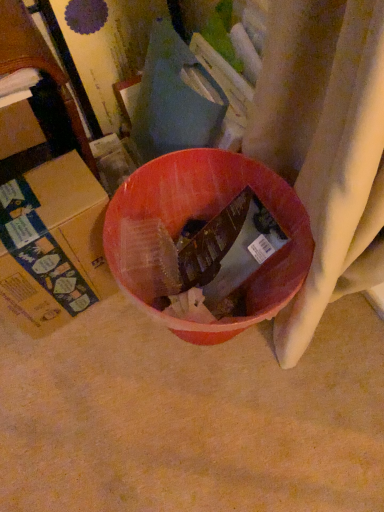
Measure the distance between cardboard box at left, which is counted as the second cardboard box, starting from the bottom, and camera.

26.34 inches.

What do you see at coordinates (19, 129) in the screenshot? This screenshot has width=384, height=512. I see `cardboard box at left, which is counted as the second cardboard box, starting from the bottom` at bounding box center [19, 129].

I want to click on cardboard box at left, marked as the 1th cardboard box in a top-to-bottom arrangement, so click(x=19, y=129).

Image resolution: width=384 pixels, height=512 pixels. What are the coordinates of `cardboard box at left, positioned as the second cardboard box in top-to-bottom order` in the screenshot? It's located at (52, 245).

What do you see at coordinates (52, 245) in the screenshot? I see `cardboard box at left, the 1th cardboard box from the bottom` at bounding box center [52, 245].

Where is `cardboard box at left, which is counted as the second cardboard box, starting from the bottom`? cardboard box at left, which is counted as the second cardboard box, starting from the bottom is located at coordinates (19, 129).

Between cardboard box at left, the 1th cardboard box from the bottom, and cardboard box at left, which is counted as the second cardboard box, starting from the bottom, which one appears on the left side from the viewer's perspective?

From the viewer's perspective, cardboard box at left, which is counted as the second cardboard box, starting from the bottom, appears more on the left side.

In the scene shown: Which is in front, cardboard box at left, positioned as the second cardboard box in top-to-bottom order, or cardboard box at left, which is counted as the second cardboard box, starting from the bottom?

cardboard box at left, positioned as the second cardboard box in top-to-bottom order.

Considering the points (94, 231) and (10, 105), which point is in front, point (94, 231) or point (10, 105)?

The point (10, 105) is closer to the camera.

From the image's perspective, is cardboard box at left, positioned as the second cardboard box in top-to-bottom order, positioned above or below cardboard box at left, marked as the 1th cardboard box in a top-to-bottom arrangement?

From the image's perspective, cardboard box at left, positioned as the second cardboard box in top-to-bottom order, appears below cardboard box at left, marked as the 1th cardboard box in a top-to-bottom arrangement.

From a real-world perspective, is cardboard box at left, the 1th cardboard box from the bottom, physically located above or below cardboard box at left, marked as the 1th cardboard box in a top-to-bottom arrangement?

cardboard box at left, the 1th cardboard box from the bottom, is situated lower than cardboard box at left, marked as the 1th cardboard box in a top-to-bottom arrangement, in the real world.

Between cardboard box at left, positioned as the second cardboard box in top-to-bottom order, and cardboard box at left, which is counted as the second cardboard box, starting from the bottom, which one has larger width?

cardboard box at left, positioned as the second cardboard box in top-to-bottom order.

In terms of height, does cardboard box at left, positioned as the second cardboard box in top-to-bottom order, look taller or shorter compared to cardboard box at left, which is counted as the second cardboard box, starting from the bottom?

Considering their sizes, cardboard box at left, positioned as the second cardboard box in top-to-bottom order, has more height than cardboard box at left, which is counted as the second cardboard box, starting from the bottom.

Which of these two, cardboard box at left, the 1th cardboard box from the bottom, or cardboard box at left, marked as the 1th cardboard box in a top-to-bottom arrangement, is bigger?

With larger size is cardboard box at left, the 1th cardboard box from the bottom.

Would you say cardboard box at left, which is counted as the second cardboard box, starting from the bottom, is part of cardboard box at left, positioned as the second cardboard box in top-to-bottom order,'s contents?

No.

Is cardboard box at left, the 1th cardboard box from the bottom, positioned far away from cardboard box at left, which is counted as the second cardboard box, starting from the bottom?

cardboard box at left, the 1th cardboard box from the bottom, is actually quite close to cardboard box at left, which is counted as the second cardboard box, starting from the bottom.

Is cardboard box at left, which is counted as the second cardboard box, starting from the bottom, at the back of cardboard box at left, the 1th cardboard box from the bottom?

Yes, cardboard box at left, the 1th cardboard box from the bottom,'s orientation is away from cardboard box at left, which is counted as the second cardboard box, starting from the bottom.

Where is `cardboard box that is behind the cardboard box at left, the 1th cardboard box from the bottom`? This screenshot has height=512, width=384. cardboard box that is behind the cardboard box at left, the 1th cardboard box from the bottom is located at coordinates (19, 129).

Can you confirm if cardboard box at left, marked as the 1th cardboard box in a top-to-bottom arrangement, is positioned to the left of cardboard box at left, positioned as the second cardboard box in top-to-bottom order?

Indeed, cardboard box at left, marked as the 1th cardboard box in a top-to-bottom arrangement, is positioned on the left side of cardboard box at left, positioned as the second cardboard box in top-to-bottom order.

Considering their positions, is cardboard box at left, marked as the 1th cardboard box in a top-to-bottom arrangement, located in front of or behind cardboard box at left, positioned as the second cardboard box in top-to-bottom order?

In the image, cardboard box at left, marked as the 1th cardboard box in a top-to-bottom arrangement, appears behind cardboard box at left, positioned as the second cardboard box in top-to-bottom order.

Is point (38, 137) closer to viewer compared to point (50, 173)?

No, (38, 137) is further to viewer.

From the image's perspective, is cardboard box at left, marked as the 1th cardboard box in a top-to-bottom arrangement, above cardboard box at left, the 1th cardboard box from the bottom?

Yes, from the image's perspective, cardboard box at left, marked as the 1th cardboard box in a top-to-bottom arrangement, is on top of cardboard box at left, the 1th cardboard box from the bottom.

From a real-world perspective, which object stands above the other?

cardboard box at left, which is counted as the second cardboard box, starting from the bottom.

Between cardboard box at left, marked as the 1th cardboard box in a top-to-bottom arrangement, and cardboard box at left, the 1th cardboard box from the bottom, which one has smaller width?

With smaller width is cardboard box at left, marked as the 1th cardboard box in a top-to-bottom arrangement.

Is cardboard box at left, which is counted as the second cardboard box, starting from the bottom, shorter than cardboard box at left, positioned as the second cardboard box in top-to-bottom order?

Yes, cardboard box at left, which is counted as the second cardboard box, starting from the bottom, is shorter than cardboard box at left, positioned as the second cardboard box in top-to-bottom order.

Can you confirm if cardboard box at left, marked as the 1th cardboard box in a top-to-bottom arrangement, is bigger than cardboard box at left, positioned as the second cardboard box in top-to-bottom order?

No.

Is cardboard box at left, marked as the 1th cardboard box in a top-to-bottom arrangement, not inside cardboard box at left, the 1th cardboard box from the bottom?

cardboard box at left, marked as the 1th cardboard box in a top-to-bottom arrangement, lies outside cardboard box at left, the 1th cardboard box from the bottom,'s area.

Would you consider cardboard box at left, which is counted as the second cardboard box, starting from the bottom, to be distant from cardboard box at left, positioned as the second cardboard box in top-to-bottom order?

No, cardboard box at left, which is counted as the second cardboard box, starting from the bottom, is not far from cardboard box at left, positioned as the second cardboard box in top-to-bottom order.

Is cardboard box at left, which is counted as the second cardboard box, starting from the bottom, facing away from cardboard box at left, positioned as the second cardboard box in top-to-bottom order?

cardboard box at left, which is counted as the second cardboard box, starting from the bottom, is not turned away from cardboard box at left, positioned as the second cardboard box in top-to-bottom order.

Looking at this image, how distant is cardboard box at left, which is counted as the second cardboard box, starting from the bottom, from cardboard box at left, positioned as the second cardboard box in top-to-bottom order?

cardboard box at left, which is counted as the second cardboard box, starting from the bottom, and cardboard box at left, positioned as the second cardboard box in top-to-bottom order, are 8.55 inches apart.

The height and width of the screenshot is (512, 384). Identify the location of cardboard box on the left of cardboard box at left, the 1th cardboard box from the bottom. [19, 129].

At what (x,y) coordinates should I click in order to perform the action: click on cardboard box below the cardboard box at left, marked as the 1th cardboard box in a top-to-bottom arrangement (from the image's perspective). Please return your answer as a coordinate pair (x, y). Looking at the image, I should click on (52, 245).

Where is `cardboard box in front of the cardboard box at left, marked as the 1th cardboard box in a top-to-bottom arrangement`? This screenshot has width=384, height=512. cardboard box in front of the cardboard box at left, marked as the 1th cardboard box in a top-to-bottom arrangement is located at coordinates point(52,245).